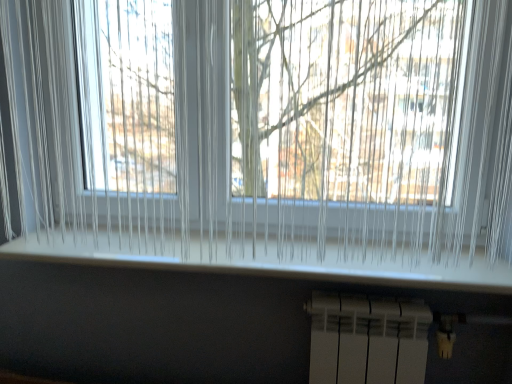
In order to face white plastic window sill at center, should I rotate leftwards or rightwards?

You should look left and rotate roughly 2.319 degrees.

What is the approximate height of white plastic window sill at center?

white plastic window sill at center is 0.89 inches tall.

Identify the location of white plastic window sill at center. (267, 259).

Image resolution: width=512 pixels, height=384 pixels. Describe the element at coordinates (267, 259) in the screenshot. I see `white plastic window sill at center` at that location.

The image size is (512, 384). What do you see at coordinates (367, 340) in the screenshot? I see `white plastic radiator at bottom` at bounding box center [367, 340].

Image resolution: width=512 pixels, height=384 pixels. Find the location of `white plastic radiator at bottom`. white plastic radiator at bottom is located at coordinates 367,340.

Where is `white plastic window sill at center`? Image resolution: width=512 pixels, height=384 pixels. white plastic window sill at center is located at coordinates (267, 259).

Consider the image. Based on their positions, is white plastic radiator at bottom located to the left or right of white plastic window sill at center?

In the image, white plastic radiator at bottom appears on the right side of white plastic window sill at center.

Does white plastic radiator at bottom lie behind white plastic window sill at center?

That is True.

Considering the points (382, 320) and (104, 258), which point is in front, point (382, 320) or point (104, 258)?

The point (382, 320) is closer.

Looking at this image, from the image's perspective, which object appears higher, white plastic radiator at bottom or white plastic window sill at center?

white plastic window sill at center.

From a real-world perspective, between white plastic radiator at bottom and white plastic window sill at center, who is vertically lower?

white plastic radiator at bottom.

Does white plastic radiator at bottom have a greater width compared to white plastic window sill at center?

Incorrect, the width of white plastic radiator at bottom does not surpass that of white plastic window sill at center.

Which of these two, white plastic radiator at bottom or white plastic window sill at center, stands shorter?

With less height is white plastic window sill at center.

Based on their sizes in the image, would you say white plastic radiator at bottom is bigger or smaller than white plastic window sill at center?

Clearly, white plastic radiator at bottom is larger in size than white plastic window sill at center.

Can white plastic window sill at center be found inside white plastic radiator at bottom?

That's incorrect, white plastic window sill at center is not inside white plastic radiator at bottom.

Would you say white plastic radiator at bottom is a long distance from white plastic window sill at center?

They are positioned close to each other.

Is white plastic radiator at bottom positioned with its back to white plastic window sill at center?

No, white plastic radiator at bottom is not facing away from white plastic window sill at center.

At what (x,y) coordinates should I click in order to perform the action: click on window sill above the white plastic radiator at bottom (from the image's perspective). Please return your answer as a coordinate pair (x, y). Image resolution: width=512 pixels, height=384 pixels. Looking at the image, I should click on (267, 259).

From the picture: Considering the relative positions of white plastic window sill at center and white plastic radiator at bottom in the image provided, is white plastic window sill at center to the right of white plastic radiator at bottom from the viewer's perspective?

No.

Is white plastic window sill at center positioned before white plastic radiator at bottom?

Yes, white plastic window sill at center is in front of white plastic radiator at bottom.

Does point (187, 268) lie behind point (390, 352)?

Yes, point (187, 268) is behind point (390, 352).

From the image's perspective, would you say white plastic window sill at center is shown under white plastic radiator at bottom?

No, from the image's perspective, white plastic window sill at center is not below white plastic radiator at bottom.

From a real-world perspective, is white plastic window sill at center located higher than white plastic radiator at bottom?

Yes, from a real-world perspective, white plastic window sill at center is over white plastic radiator at bottom

Considering the relative sizes of white plastic window sill at center and white plastic radiator at bottom in the image provided, is white plastic window sill at center thinner than white plastic radiator at bottom?

In fact, white plastic window sill at center might be wider than white plastic radiator at bottom.

Considering the sizes of objects white plastic window sill at center and white plastic radiator at bottom in the image provided, who is taller, white plastic window sill at center or white plastic radiator at bottom?

white plastic radiator at bottom.

Based on their sizes in the image, would you say white plastic window sill at center is bigger or smaller than white plastic radiator at bottom?

In the image, white plastic window sill at center appears to be smaller than white plastic radiator at bottom.

Is white plastic window sill at center not inside white plastic radiator at bottom?

Yes, white plastic window sill at center is outside of white plastic radiator at bottom.

Is white plastic window sill at center not close to white plastic radiator at bottom?

white plastic window sill at center is actually quite close to white plastic radiator at bottom.

Consider the image. Is white plastic window sill at center aimed at white plastic radiator at bottom?

No, white plastic window sill at center is not oriented towards white plastic radiator at bottom.

Where is `window sill in front of the white plastic radiator at bottom`? Image resolution: width=512 pixels, height=384 pixels. window sill in front of the white plastic radiator at bottom is located at coordinates (267, 259).

This screenshot has width=512, height=384. Find the location of `radiator behind the white plastic window sill at center`. radiator behind the white plastic window sill at center is located at coordinates (367, 340).

Image resolution: width=512 pixels, height=384 pixels. What are the coordinates of `radiator below the white plastic window sill at center (from a real-world perspective)` in the screenshot? It's located at (367, 340).